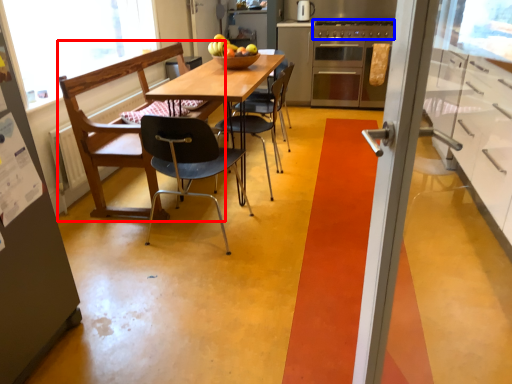
Question: Which of the following is the closest to the observer, chair (highlighted by a red box) or stove (highlighted by a blue box)?

Choices:
 (A) chair
 (B) stove

Answer: (A)